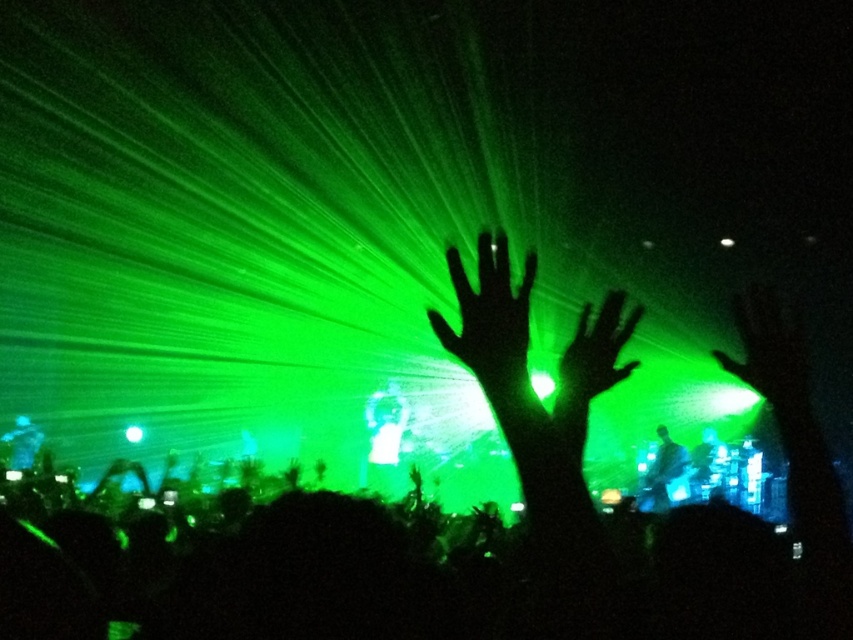
You are a photographer standing in the crowd at the concert. You want to take a photo of the black matte hand at center without any obstructions. Considering your current position, can you estimate if the hand will be clearly visible in your shot?

The black matte hand at center is 1.63 meters away from viewer, so yes, the hand will be clearly visible in your shot as it is within a reasonable distance for photography.

You are a photographer trying to capture the concert stage. You notice two points in the image labeled as point (x=618, y=349) and point (x=380, y=477). Which point should you focus on first if you want to ensure the foreground elements are sharp?

Point (x=618, y=349) should be focused on first because it is closer to the camera than point (x=380, y=477), ensuring the foreground elements are sharp.

Consider the image. You are a photographer trying to capture the perfect shot of the concert. You notice a green matte hand at center located at point (595, 355). Can you confirm if this hand is part of the concertgoers in the foreground or the musicians in the background?

The green matte hand at center located at point (595, 355) is part of the concertgoers in the foreground since the description mentions that the silhouettes of concertgoers are in the foreground with raised hands, while the musicians are in the background with faint outlines.